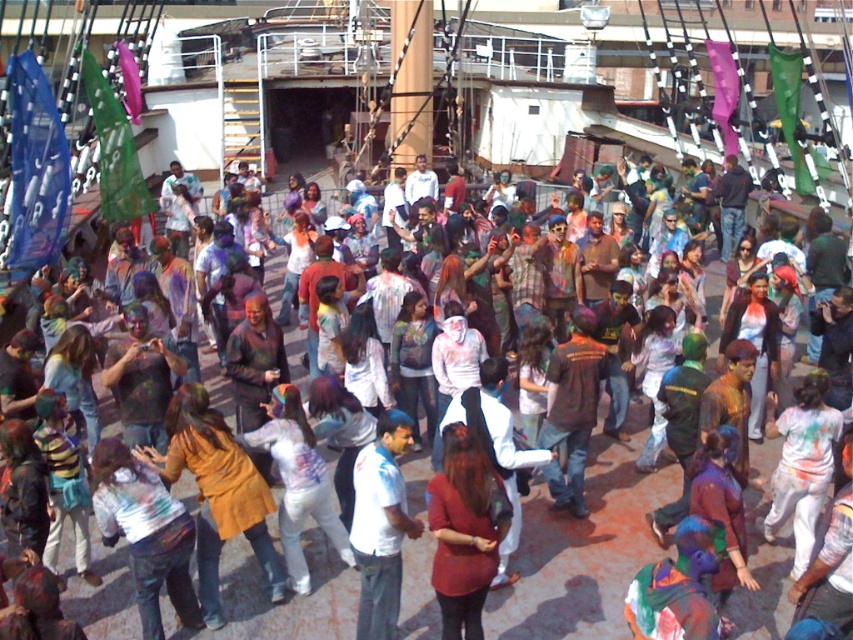
Question: Can you confirm if matte red shirt at center is smaller than white cotton shirt at center?

Choices:
 (A) yes
 (B) no

Answer: (B)

Question: Among these points, which one is farthest from the camera?

Choices:
 (A) (445, 481)
 (B) (364, 593)

Answer: (B)

Question: Among these points, which one is nearest to the camera?

Choices:
 (A) (358, 630)
 (B) (463, 616)

Answer: (B)

Question: Is matte red shirt at center bigger than white cotton shirt at center?

Choices:
 (A) no
 (B) yes

Answer: (B)

Question: Can you confirm if matte red shirt at center is wider than white cotton shirt at center?

Choices:
 (A) yes
 (B) no

Answer: (A)

Question: Which point appears closest to the camera in this image?

Choices:
 (A) (457, 486)
 (B) (386, 458)

Answer: (A)